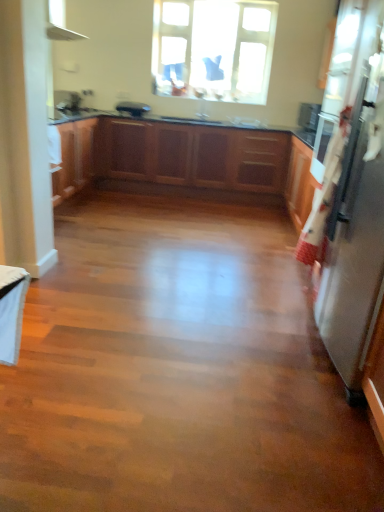
Question: Is satin silver refrigerator at right, arranged as the first appliance when ordered from the bottom, positioned beyond the bounds of satin black toaster at center, the 2th appliance from the right?

Choices:
 (A) no
 (B) yes

Answer: (B)

Question: Does satin silver refrigerator at right, marked as the first appliance in a front-to-back arrangement, have a larger size compared to satin black toaster at center, the 2th appliance when ordered from bottom to top?

Choices:
 (A) yes
 (B) no

Answer: (A)

Question: Can you confirm if satin silver refrigerator at right, which ranks as the second appliance in back-to-front order, is shorter than satin black toaster at center, positioned as the 2th appliance in front-to-back order?

Choices:
 (A) no
 (B) yes

Answer: (A)

Question: Does satin silver refrigerator at right, placed as the first appliance when sorted from right to left, have a lesser width compared to satin black toaster at center, the 2th appliance when ordered from bottom to top?

Choices:
 (A) no
 (B) yes

Answer: (A)

Question: Is satin silver refrigerator at right, which ranks as the second appliance in back-to-front order, looking in the opposite direction of satin black toaster at center, the 2th appliance from the right?

Choices:
 (A) no
 (B) yes

Answer: (A)

Question: Would you say satin black toaster at center, the 2th appliance when ordered from bottom to top, is inside or outside white glossy sink at center?

Choices:
 (A) outside
 (B) inside

Answer: (A)

Question: Considering the positions of satin black toaster at center, placed as the first appliance when sorted from back to front, and white glossy sink at center in the image, is satin black toaster at center, placed as the first appliance when sorted from back to front, taller or shorter than white glossy sink at center?

Choices:
 (A) short
 (B) tall

Answer: (B)

Question: Considering the positions of point (144, 106) and point (256, 126), is point (144, 106) closer or farther from the camera than point (256, 126)?

Choices:
 (A) closer
 (B) farther

Answer: (B)

Question: Based on their positions, is satin black toaster at center, placed as the first appliance when sorted from back to front, located to the left or right of white glossy sink at center?

Choices:
 (A) right
 (B) left

Answer: (B)

Question: In the image, is satin black toaster at center, the first appliance positioned from the top, positioned in front of or behind satin silver refrigerator at right, which appears as the 2th appliance when viewed from the top?

Choices:
 (A) behind
 (B) front

Answer: (A)

Question: From a real-world perspective, is satin black toaster at center, placed as the first appliance when sorted from back to front, physically located above or below satin silver refrigerator at right, arranged as the first appliance when ordered from the bottom?

Choices:
 (A) below
 (B) above

Answer: (B)

Question: From the image's perspective, relative to satin silver refrigerator at right, which ranks as the second appliance in back-to-front order, is satin black toaster at center, placed as the first appliance when sorted from back to front, above or below?

Choices:
 (A) above
 (B) below

Answer: (A)

Question: Is satin black toaster at center, positioned as the 2th appliance in front-to-back order, wider or thinner than satin silver refrigerator at right, arranged as the first appliance when ordered from the bottom?

Choices:
 (A) thin
 (B) wide

Answer: (A)

Question: Is white glossy sink at center bigger or smaller than transparent glass window at upper center?

Choices:
 (A) small
 (B) big

Answer: (A)

Question: Considering the positions of white glossy sink at center and transparent glass window at upper center in the image, is white glossy sink at center wider or thinner than transparent glass window at upper center?

Choices:
 (A) wide
 (B) thin

Answer: (A)